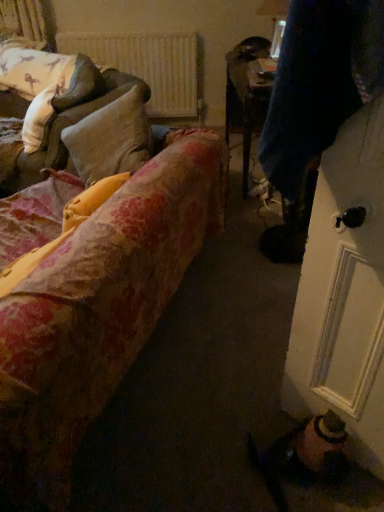
Question: Considering the positions of velvet dark blue coat at right and white textured radiator at upper center in the image, is velvet dark blue coat at right taller or shorter than white textured radiator at upper center?

Choices:
 (A) tall
 (B) short

Answer: (A)

Question: Would you say velvet dark blue coat at right is inside or outside white textured radiator at upper center?

Choices:
 (A) outside
 (B) inside

Answer: (A)

Question: Which is nearer to the velvet dark blue coat at right?

Choices:
 (A) floral fabric couch at left, the 2th studio couch viewed from the front
 (B) white textured radiator at upper center
 (C) white soft pillow at upper left
 (D) floral fabric couch at left, acting as the second studio couch starting from the back

Answer: (D)

Question: Estimate the real-world distances between objects in this image. Which object is farther from the velvet dark blue coat at right?

Choices:
 (A) white soft pillow at upper left
 (B) white textured radiator at upper center
 (C) floral fabric couch at left, the 2th studio couch viewed from the front
 (D) floral fabric couch at left, positioned as the 1th studio couch in front-to-back order

Answer: (B)